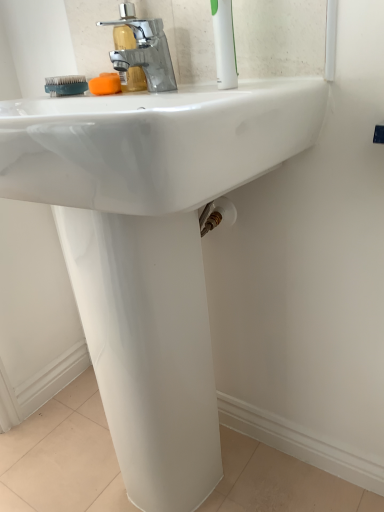
The height and width of the screenshot is (512, 384). I want to click on vacant point to the left of white plastic toothbrush at upper right, so click(139, 102).